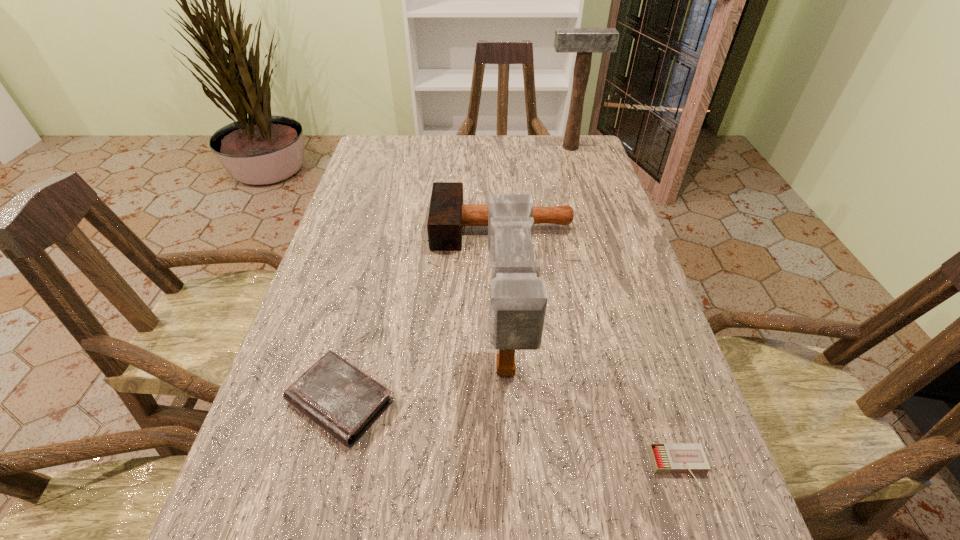
Find the location of a particular element. This screenshot has width=960, height=540. object that is the second closest to the farthest mallet is located at coordinates (518, 300).

The height and width of the screenshot is (540, 960). I want to click on mallet that is the closest to the nearest mallet, so click(x=447, y=215).

Choose which mallet is the nearest neighbor to the leftmost object. Please provide its 2D coordinates. Your answer should be formatted as a tuple, i.e. [(x, y)], where the tuple contains the x and y coordinates of a point satisfying the conditions above.

[(518, 300)]

At what (x,y) coordinates should I click in order to perform the action: click on free space that satisfies the following two spatial constraints: 1. on the back side of the nearest mallet; 2. on the left side of the diary. Please return your answer as a coordinate pair (x, y). The width and height of the screenshot is (960, 540). Looking at the image, I should click on (348, 373).

The height and width of the screenshot is (540, 960). Identify the location of vacant position in the image that satisfies the following two spatial constraints: 1. on the back side of the nearest mallet; 2. on the right side of the second shortest object. (348, 373).

At what (x,y) coordinates should I click in order to perform the action: click on free location that satisfies the following two spatial constraints: 1. on the back side of the farthest object; 2. on the left side of the diary. Please return your answer as a coordinate pair (x, y). Image resolution: width=960 pixels, height=540 pixels. Looking at the image, I should click on (405, 147).